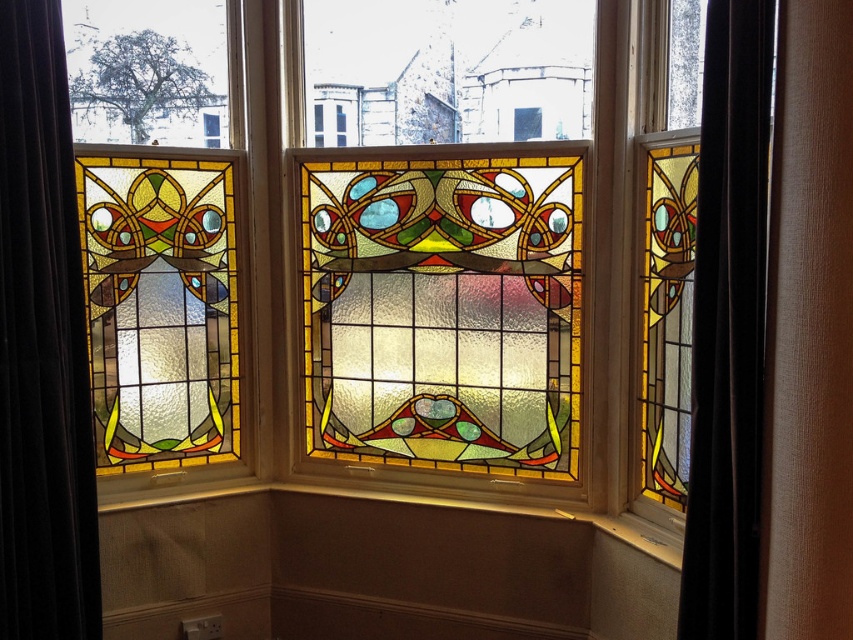
Which of these two, multicolored stained glass at center or velvet dark brown curtain at left, stands taller?

velvet dark brown curtain at left is taller.

What do you see at coordinates (444, 310) in the screenshot?
I see `multicolored stained glass at center` at bounding box center [444, 310].

Where is `multicolored stained glass at center`? multicolored stained glass at center is located at coordinates (444, 310).

Which is in front, point (24, 282) or point (703, 282)?

Point (703, 282)

Measure the distance from velvet dark brown curtain at left to black velvet curtain at right.

1.79 meters

Who is more distant from viewer, (73, 417) or (712, 508)?

The point (73, 417) is behind.

Locate an element on the screen. velvet dark brown curtain at left is located at coordinates (42, 346).

What are the coordinates of `multicolored stained glass at center` in the screenshot? It's located at (444, 310).

Is point (363, 442) closer to viewer compared to point (756, 417)?

No, (363, 442) is further to viewer.

This screenshot has width=853, height=640. What are the coordinates of `multicolored stained glass at center` in the screenshot? It's located at (444, 310).